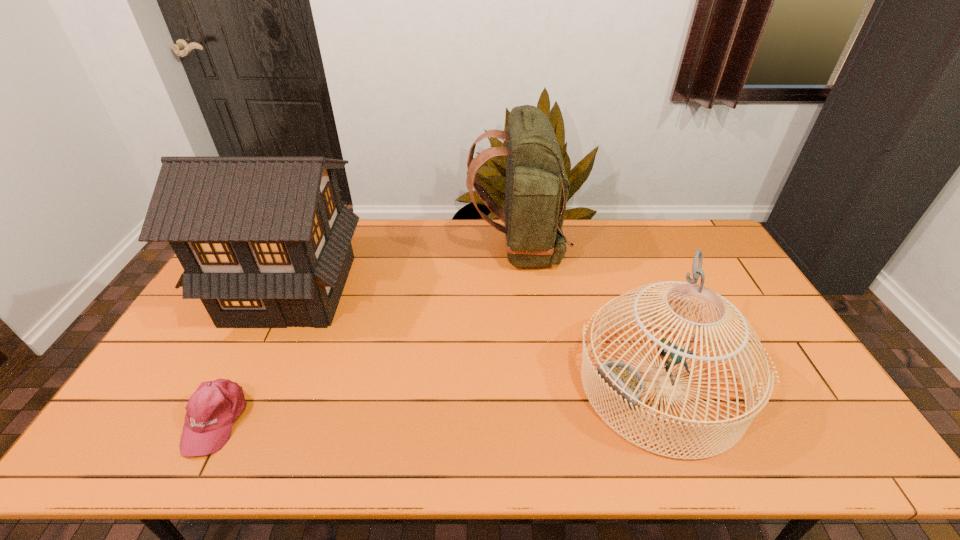
Locate an element on the screen. blank space at the right edge is located at coordinates point(798,387).

This screenshot has height=540, width=960. I want to click on empty space that is in between the backpack and the dollhouse, so (404, 269).

Locate an element on the screen. vacant area between the birdcage and the backpack is located at coordinates (589, 316).

Locate an element on the screen. Image resolution: width=960 pixels, height=540 pixels. free space between the birdcage and the backpack is located at coordinates click(589, 316).

Where is `free space that is in between the birdcage and the dollhouse`? free space that is in between the birdcage and the dollhouse is located at coordinates (476, 336).

Where is `blank region between the birdcage and the baseball cap`? The height and width of the screenshot is (540, 960). blank region between the birdcage and the baseball cap is located at coordinates (439, 401).

Where is `vacant space in between the birdcage and the baseball cap`? The width and height of the screenshot is (960, 540). vacant space in between the birdcage and the baseball cap is located at coordinates (439, 401).

Identify the location of free area in between the backpack and the baseball cap. (367, 334).

At what (x,y) coordinates should I click in order to perform the action: click on vacant area that lies between the birdcage and the backpack. Please return your answer as a coordinate pair (x, y). The width and height of the screenshot is (960, 540). Looking at the image, I should click on (589, 316).

Image resolution: width=960 pixels, height=540 pixels. I want to click on vacant area between the birdcage and the dollhouse, so click(476, 336).